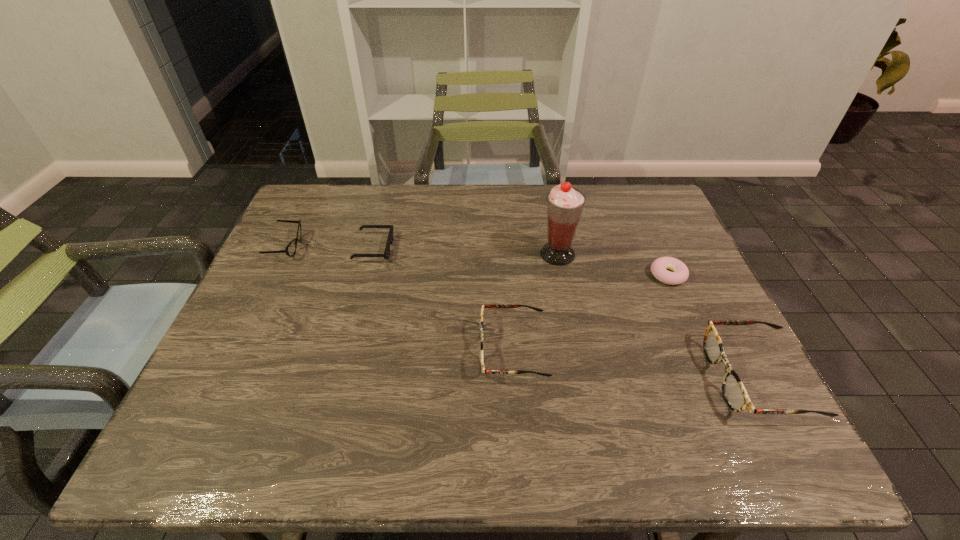
Locate which spectacles is the closest to the tallest spectacles. Please provide its 2D coordinates. Your answer should be formatted as a tuple, i.e. [(x, y)], where the tuple contains the x and y coordinates of a point satisfying the conditions above.

[(499, 306)]

Point out which spectacles is positioned as the second nearest to the third object from left to right. Please provide its 2D coordinates. Your answer should be formatted as a tuple, i.e. [(x, y)], where the tuple contains the x and y coordinates of a point satisfying the conditions above.

[(290, 250)]

Find the location of a particular element. The image size is (960, 540). free space in the image that satisfies the following two spatial constraints: 1. on the front side of the doughnut; 2. on the left side of the tallest object is located at coordinates (562, 275).

Identify the location of free spot that satisfies the following two spatial constraints: 1. on the front-facing side of the fourth object from left to right; 2. on the left side of the leftmost object. The height and width of the screenshot is (540, 960). (284, 254).

Where is `vacant space that satisfies the following two spatial constraints: 1. on the front-facing side of the tallest object; 2. on the left side of the shortest spectacles`? The width and height of the screenshot is (960, 540). vacant space that satisfies the following two spatial constraints: 1. on the front-facing side of the tallest object; 2. on the left side of the shortest spectacles is located at coordinates (284, 254).

The image size is (960, 540). Identify the location of vacant area in the image that satisfies the following two spatial constraints: 1. on the front-facing side of the fifth object from right to left; 2. on the right side of the smoothie. (372, 254).